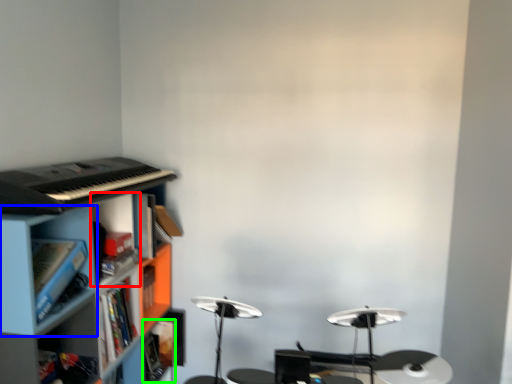
Question: Estimate the real-world distances between objects in this image. Which object is closer to cabinet (highlighted by a red box), cabinet (highlighted by a blue box) or book (highlighted by a green box)?

Choices:
 (A) cabinet
 (B) book

Answer: (A)